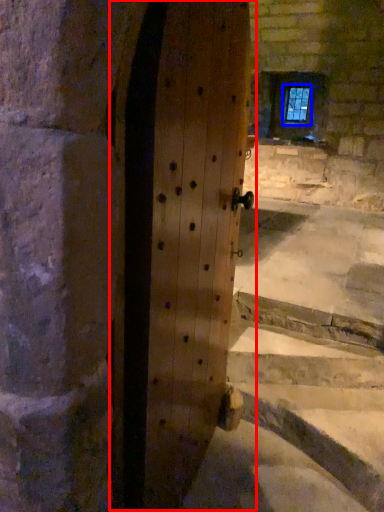
Question: Which of the following is the farthest to the observer, door (highlighted by a red box) or window (highlighted by a blue box)?

Choices:
 (A) door
 (B) window

Answer: (B)